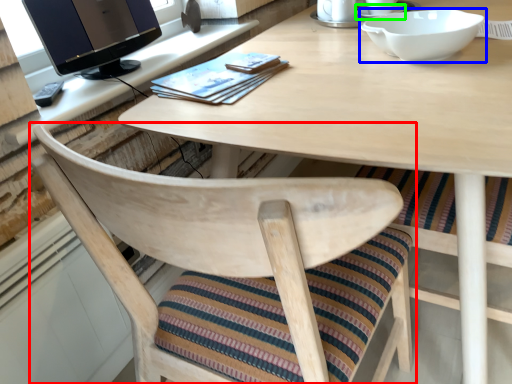
Question: Which is farther away from chair (highlighted by a red box)? bowl (highlighted by a blue box) or saucer (highlighted by a green box)?

Choices:
 (A) bowl
 (B) saucer

Answer: (B)